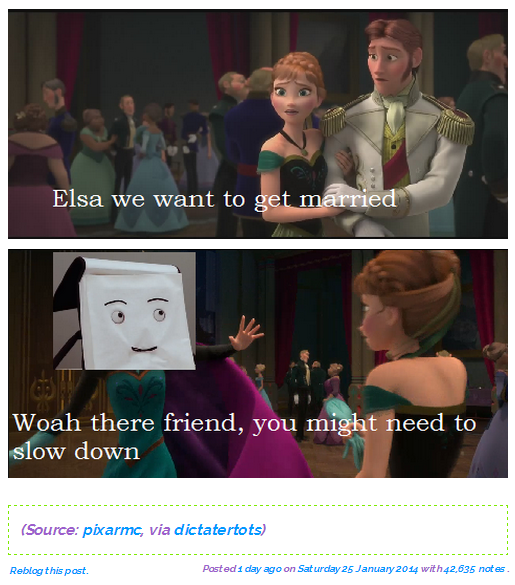
Where is `painting`? This screenshot has width=515, height=585. painting is located at coordinates (465, 329), (334, 47).